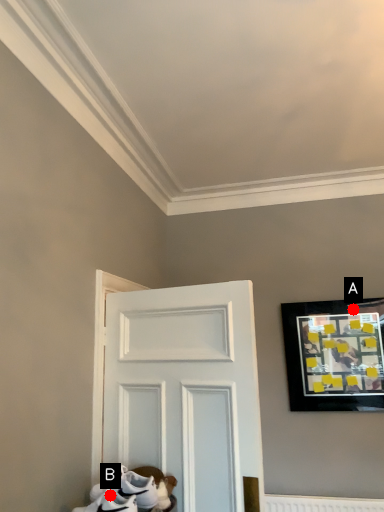
Question: Two points are circled on the image, labeled by A and B beside each circle. Which point is farther to the camera?

Choices:
 (A) A is further
 (B) B is further

Answer: (A)